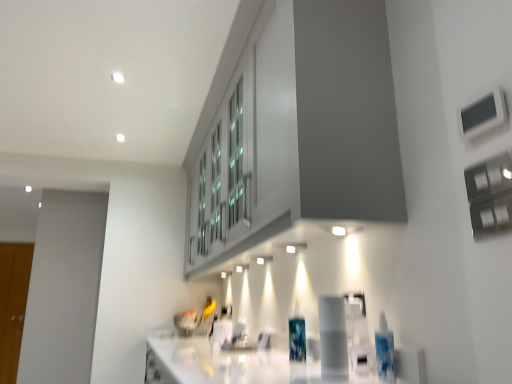
Question: Is white glossy countertop at lower center outside wooden glass door at left?

Choices:
 (A) no
 (B) yes

Answer: (B)

Question: Does white glossy countertop at lower center come behind wooden glass door at left?

Choices:
 (A) yes
 (B) no

Answer: (B)

Question: From a real-world perspective, is white glossy countertop at lower center located beneath wooden glass door at left?

Choices:
 (A) no
 (B) yes

Answer: (B)

Question: Is the depth of white glossy countertop at lower center less than that of wooden glass door at left?

Choices:
 (A) no
 (B) yes

Answer: (B)

Question: Does white glossy countertop at lower center have a lesser height compared to wooden glass door at left?

Choices:
 (A) no
 (B) yes

Answer: (B)

Question: From a real-world perspective, is translucent plastic bottle at center positioned above or below white glossy countertop at lower center?

Choices:
 (A) below
 (B) above

Answer: (B)

Question: Based on their positions, is translucent plastic bottle at center located to the left or right of white glossy countertop at lower center?

Choices:
 (A) left
 (B) right

Answer: (B)

Question: Would you say translucent plastic bottle at center is inside or outside white glossy countertop at lower center?

Choices:
 (A) inside
 (B) outside

Answer: (A)

Question: In terms of width, does translucent plastic bottle at center look wider or thinner when compared to white glossy countertop at lower center?

Choices:
 (A) wide
 (B) thin

Answer: (B)

Question: Considering their positions, is wooden glass door at left located in front of or behind white glossy countertop at lower center?

Choices:
 (A) behind
 (B) front

Answer: (A)

Question: Considering the positions of point (3, 246) and point (189, 380), is point (3, 246) closer or farther from the camera than point (189, 380)?

Choices:
 (A) farther
 (B) closer

Answer: (A)

Question: Is wooden glass door at left inside or outside of white glossy countertop at lower center?

Choices:
 (A) inside
 (B) outside

Answer: (B)

Question: From a real-world perspective, is wooden glass door at left above or below white glossy countertop at lower center?

Choices:
 (A) above
 (B) below

Answer: (A)

Question: Is translucent plastic bottle at center situated inside wooden glass door at left or outside?

Choices:
 (A) outside
 (B) inside

Answer: (A)

Question: Visually, is translucent plastic bottle at center positioned to the left or to the right of wooden glass door at left?

Choices:
 (A) right
 (B) left

Answer: (A)